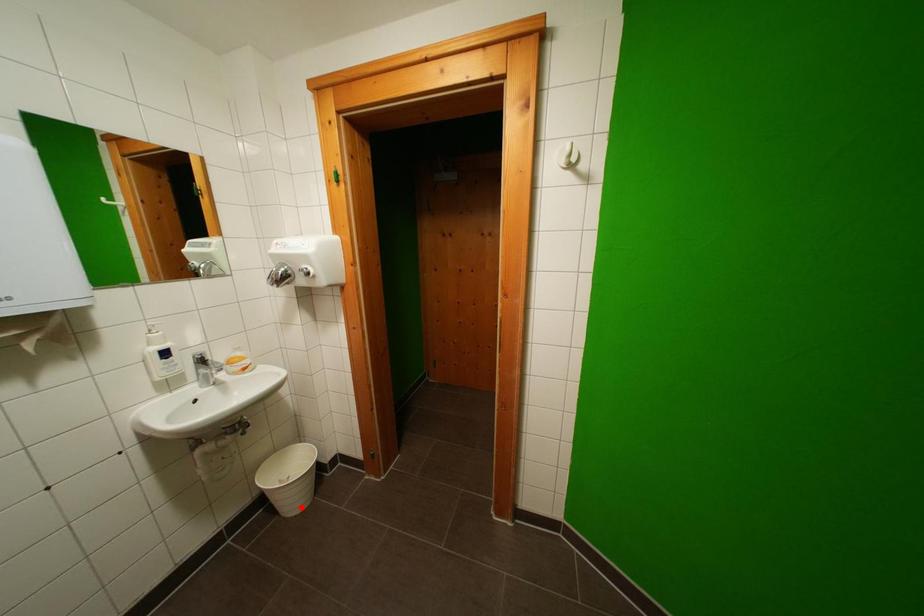
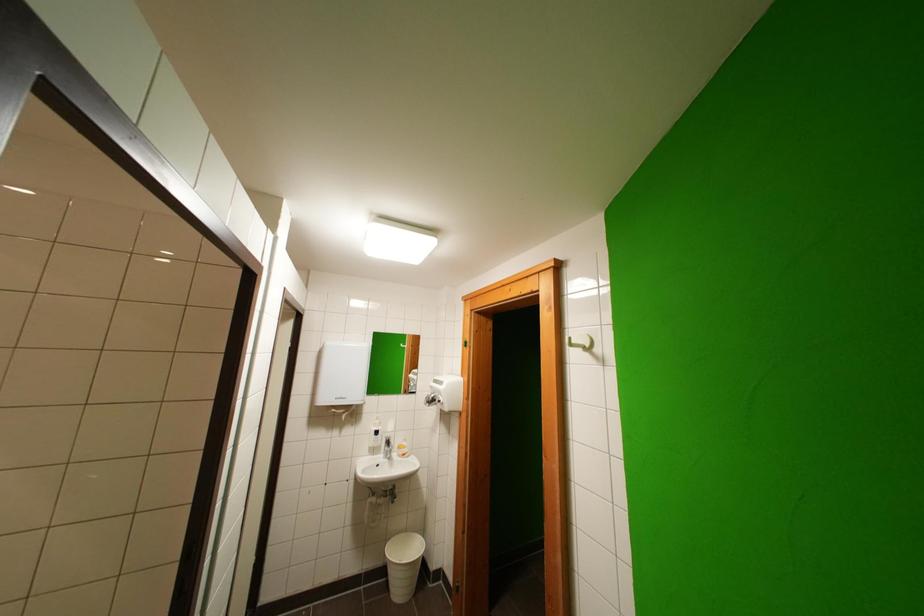
Locate, in the second image, the point that corresponds to the highlighted location in the first image.

(406, 593)